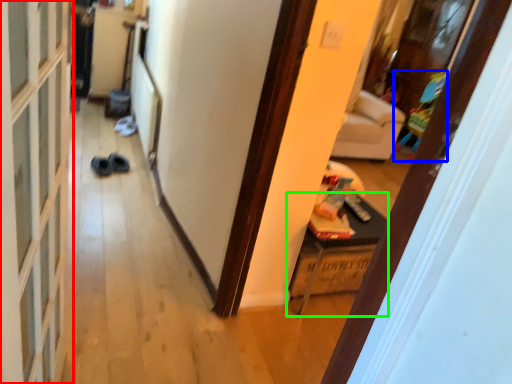
Question: Which object is positioned closest to screen door (highlighted by a red box)? Select from toy (highlighted by a blue box) and furniture (highlighted by a green box).

Choices:
 (A) toy
 (B) furniture

Answer: (B)